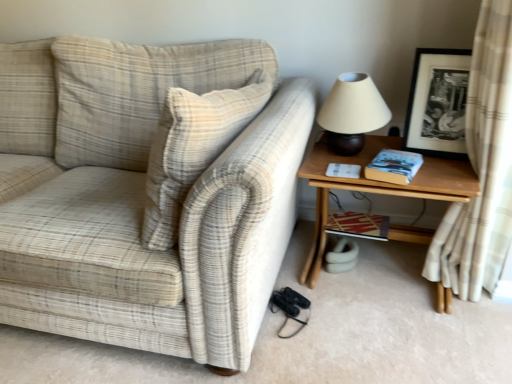
Where is `free region on the left part of hardcover book at right, the first book viewed from the front`? This screenshot has height=384, width=512. free region on the left part of hardcover book at right, the first book viewed from the front is located at coordinates (343, 159).